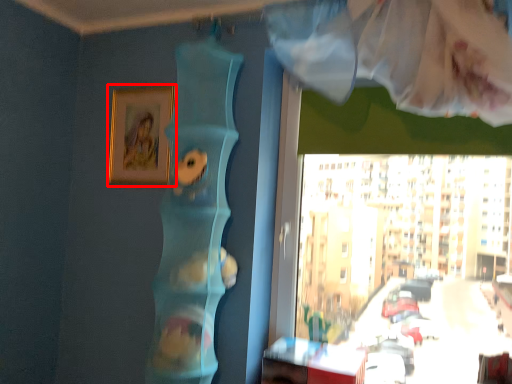
Question: Where is picture frame (annotated by the red box) located in relation to table in the image?

Choices:
 (A) right
 (B) left

Answer: (B)